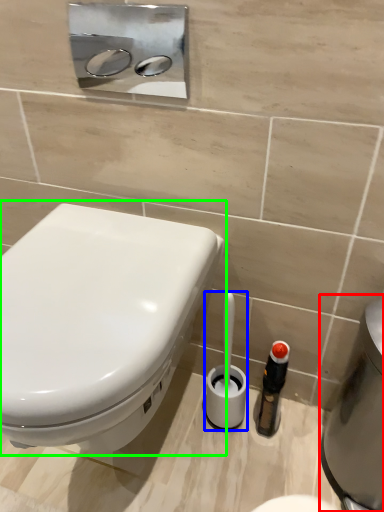
Question: Considering the real-world distances, which object is farthest from water heater (highlighted by a red box)? brush (highlighted by a blue box) or toilet (highlighted by a green box)?

Choices:
 (A) brush
 (B) toilet

Answer: (B)